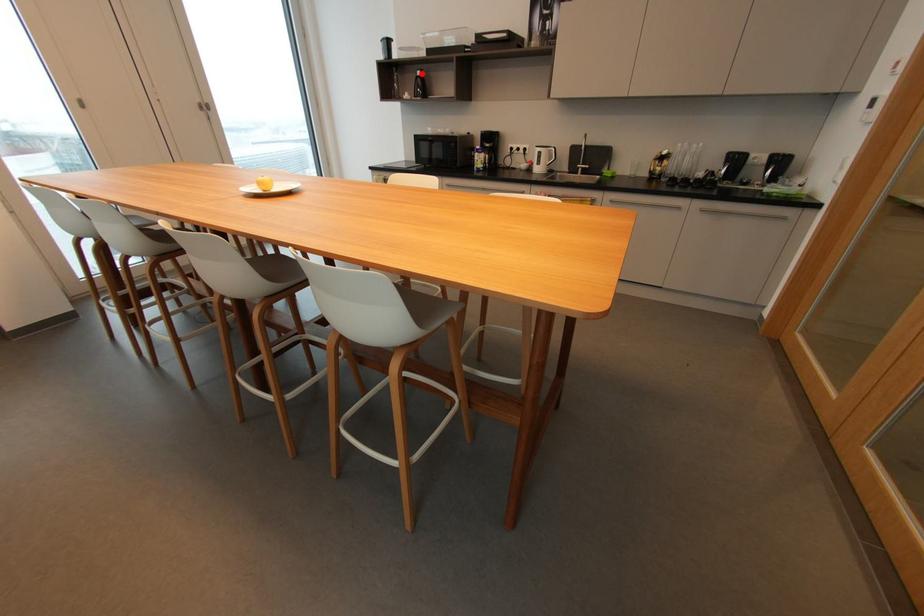
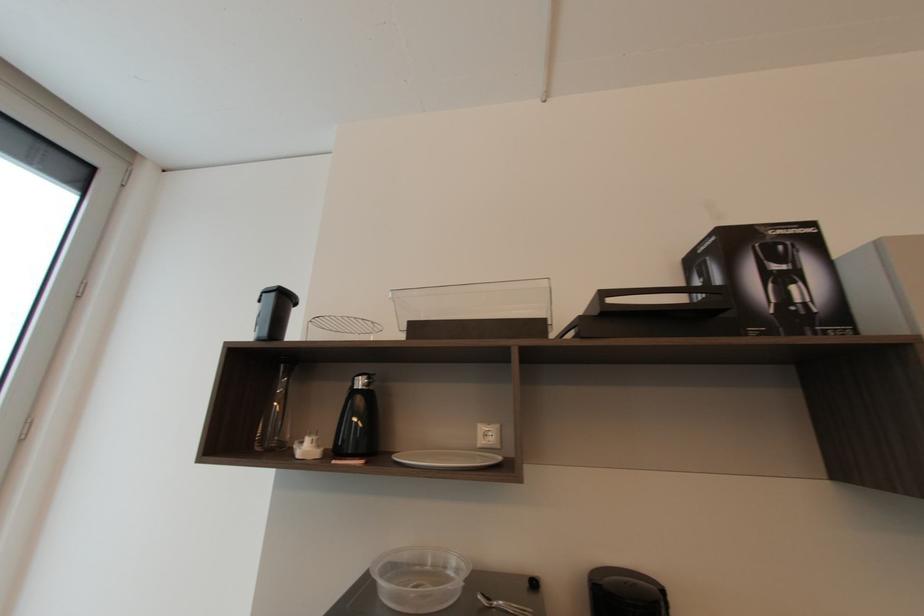
Find the pixel in the second image that matches the highlighted location in the first image.

(362, 384)